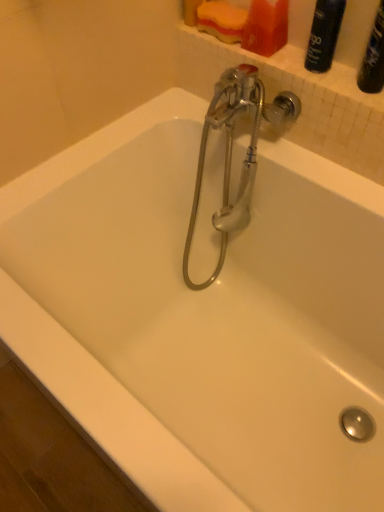
Question: From a real-world perspective, is chrome metallic faucet at center above or below matte plastic soap at upper center?

Choices:
 (A) above
 (B) below

Answer: (B)

Question: Is chrome metallic faucet at center inside the boundaries of matte plastic soap at upper center, or outside?

Choices:
 (A) inside
 (B) outside

Answer: (B)

Question: Considering the real-world distances, which object is closest to the chrome metallic faucet at center?

Choices:
 (A) matte black spray can at upper right
 (B) matte plastic soap at upper center

Answer: (B)

Question: Estimate the real-world distances between objects in this image. Which object is closer to the matte plastic soap at upper center?

Choices:
 (A) chrome metallic faucet at center
 (B) matte black spray can at upper right

Answer: (B)